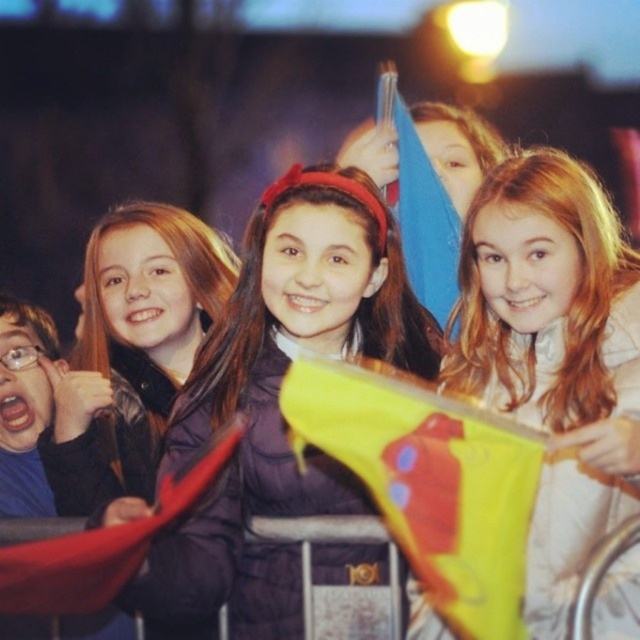
Question: Which point is closer to the camera?

Choices:
 (A) (451, 273)
 (B) (243, 289)
 (C) (358, 412)
 (D) (144, 554)

Answer: (D)

Question: Considering the real-world distances, which object is farthest from the light brown hair at center?

Choices:
 (A) blue fabric flag at upper center
 (B) yellow fabric flag at center
 (C) matte red flag at lower left
 (D) matte black jacket at left

Answer: (D)

Question: Which object is the closest to the blue fabric flag at upper center?

Choices:
 (A) yellow fabric flag at center
 (B) light brown hair at center

Answer: (B)

Question: Does matte purple jacket at center have a greater width compared to blue fabric flag at upper center?

Choices:
 (A) yes
 (B) no

Answer: (A)

Question: Can you confirm if matte red flag at lower left is bigger than blue fabric flag at upper center?

Choices:
 (A) no
 (B) yes

Answer: (B)

Question: Does light brown hair at center have a smaller size compared to yellow fabric flag at center?

Choices:
 (A) yes
 (B) no

Answer: (A)